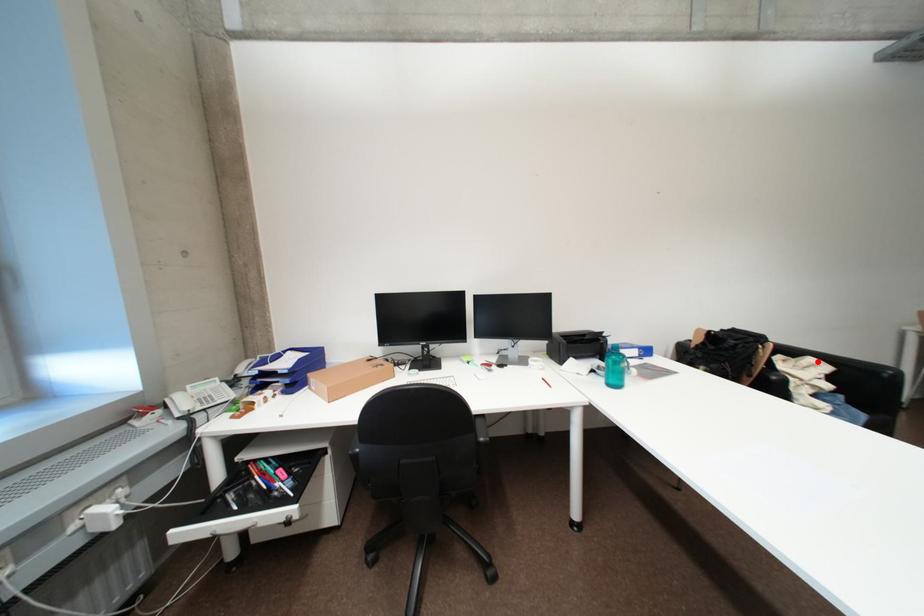
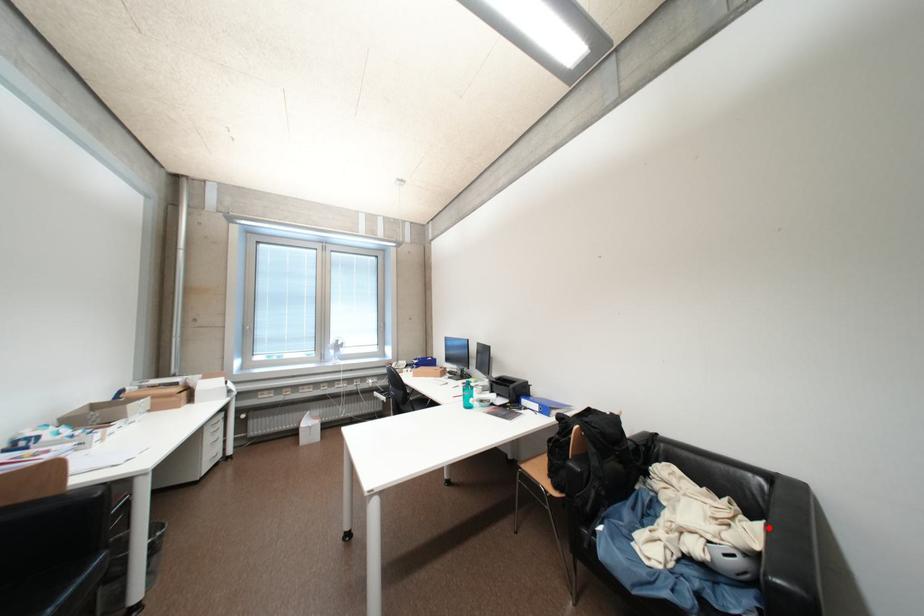
I am providing you with two images of the same scene from different viewpoints. A red point is marked on the first image and another point is marked on the second image. Is the red point in image1 aligned with the point shown in image2?

Yes